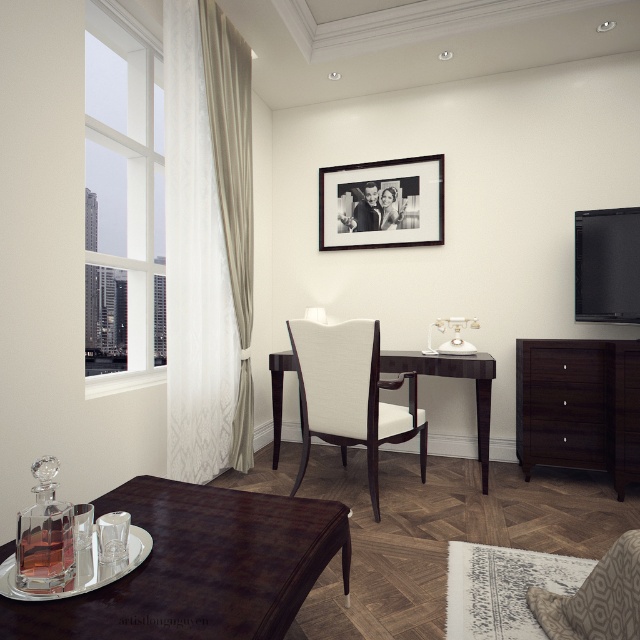
Between dark wood dresser at right and beige velvet curtain at left, which one appears on the left side from the viewer's perspective?

Positioned to the left is beige velvet curtain at left.

Between dark wood dresser at right and beige velvet curtain at left, which one is positioned lower?

Positioned lower is dark wood dresser at right.

Is point (557, 372) farther from viewer compared to point (225, 97)?

That is False.

Where is `dark wood dresser at right`? The image size is (640, 640). dark wood dresser at right is located at coordinates (x=579, y=404).

Where is `sheer beige curtain at left`? The image size is (640, 640). sheer beige curtain at left is located at coordinates (208, 241).

Is sheer beige curtain at left wider than brown leather table at lower left?

No, sheer beige curtain at left is not wider than brown leather table at lower left.

Which is in front, point (220, 218) or point (1, 554)?

Positioned in front is point (1, 554).

At what (x,y) coordinates should I click in order to perform the action: click on sheer beige curtain at left. Please return your answer as a coordinate pair (x, y). Image resolution: width=640 pixels, height=640 pixels. Looking at the image, I should click on (208, 241).

Does white glass window at left have a lesser height compared to dark wood table at center?

No.

Is white glass window at left positioned before dark wood table at center?

That is True.

Image resolution: width=640 pixels, height=640 pixels. I want to click on white glass window at left, so click(x=122, y=208).